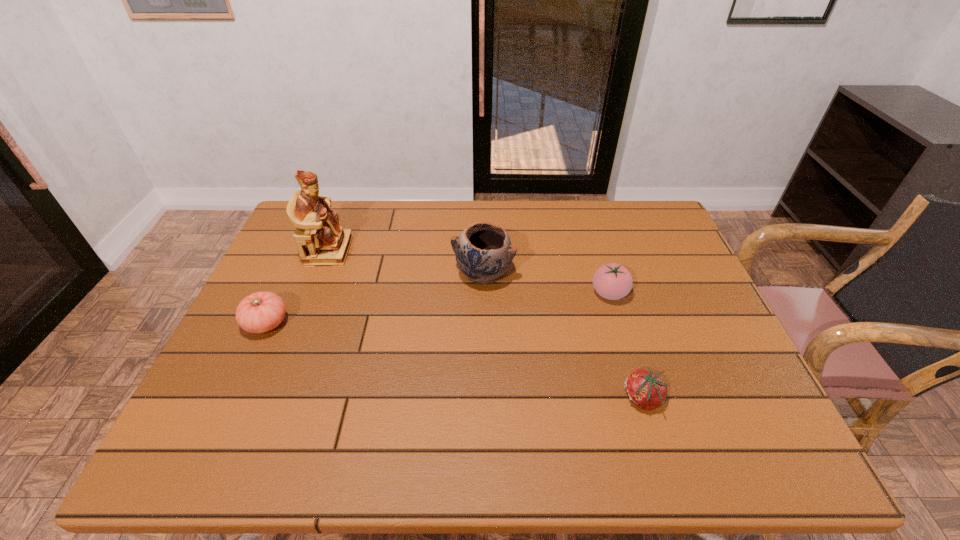
This screenshot has width=960, height=540. I want to click on figurine, so click(x=320, y=240).

The height and width of the screenshot is (540, 960). What are the coordinates of `the second tallest object` in the screenshot? It's located at (483, 251).

Locate an element on the screen. The image size is (960, 540). the third object from right to left is located at coordinates (483, 251).

Identify the location of the leftmost tomato. (260, 312).

Identify the location of the nearest object. (645, 389).

Identify the location of the shortest object. The image size is (960, 540). (645, 389).

This screenshot has width=960, height=540. What are the coordinates of `vacant space situated 0.210m on the front-facing side of the tallest object` in the screenshot? It's located at (418, 251).

What are the coordinates of `vacant space located on the front of the fourth shortest object` in the screenshot? It's located at (484, 307).

The width and height of the screenshot is (960, 540). I want to click on vacant space located 0.240m on the front of the leftmost tomato, so click(x=216, y=431).

In order to click on vacant space positioned on the left of the shortest tomato in this screenshot , I will do `click(560, 399)`.